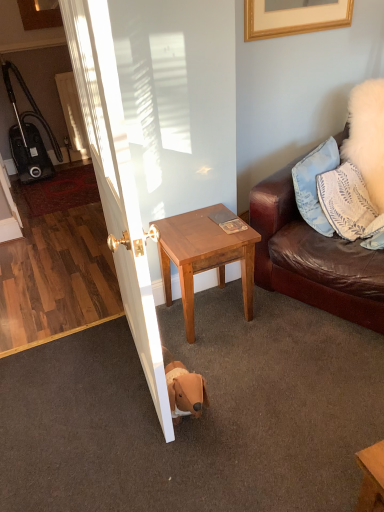
At what (x,y) coordinates should I click in order to perform the action: click on unoccupied area in front of light brown wood side table at center. Please return your answer as a coordinate pair (x, y). Image resolution: width=384 pixels, height=512 pixels. Looking at the image, I should click on (240, 358).